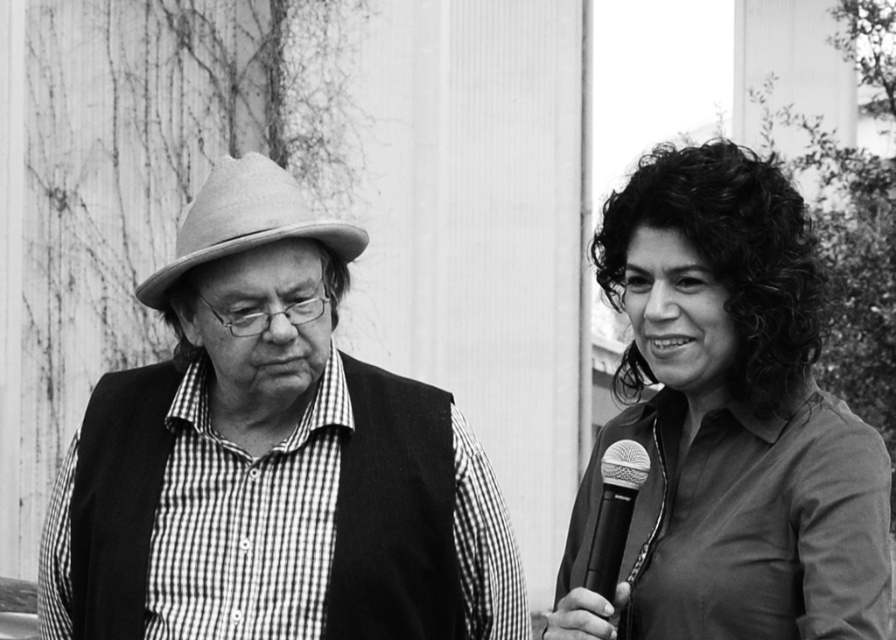
Can you confirm if checkered fabric shirt at left is positioned below curly hair at right?

Indeed, checkered fabric shirt at left is positioned under curly hair at right.

Where is `checkered fabric shirt at left`? The image size is (896, 640). checkered fabric shirt at left is located at coordinates (271, 460).

Is point (255, 189) less distant than point (612, 602)?

No.

Does felt fedora at left come in front of metallic silver microphone at right?

No, it is not.

Which is behind, point (248, 246) or point (616, 545)?

Positioned behind is point (248, 246).

Where is `felt fedora at left`? The height and width of the screenshot is (640, 896). felt fedora at left is located at coordinates (246, 221).

Is curly hair at right behind felt fedora at left?

No.

Does point (776, 529) come behind point (282, 218)?

No, it is not.

Find the location of a particular element. The height and width of the screenshot is (640, 896). curly hair at right is located at coordinates (727, 422).